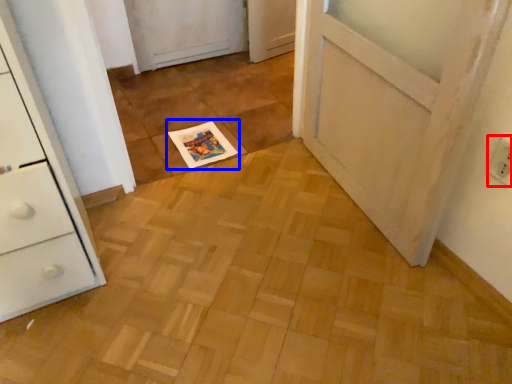
Question: Which of the following is the closest to the observer, electric outlet (highlighted by a red box) or magazine (highlighted by a blue box)?

Choices:
 (A) electric outlet
 (B) magazine

Answer: (A)